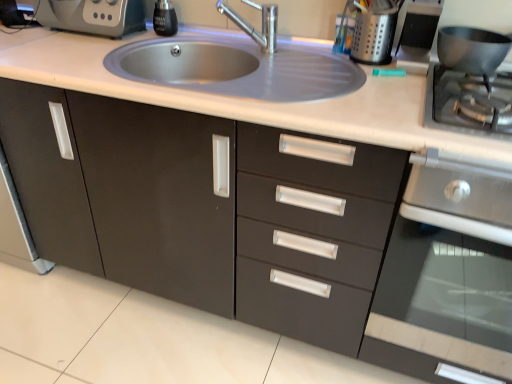
Locate an element on the screen. The width and height of the screenshot is (512, 384). vacant space that's between satin steel sink at center and satin silver utensil holder at upper right, acting as the 3th appliance starting from the right is located at coordinates (370, 88).